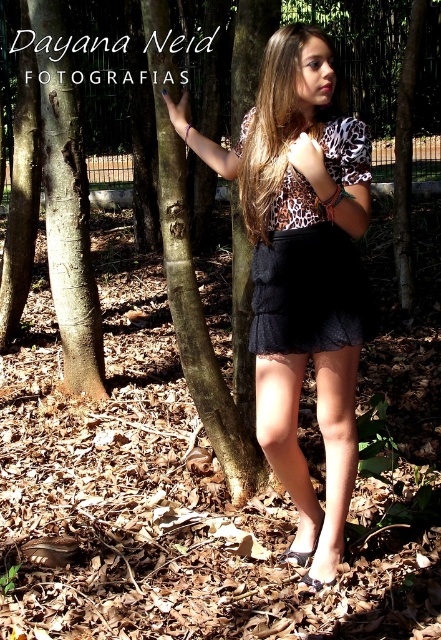
The girl is wearing two skirts, a matte black skirt at center and a black lace skirt at center. Which one is wider?

The matte black skirt at center is wider than the black lace skirt at center.

You are a photographer trying to capture the girl in the scene. You notice the black lace dress at center and the black lace skirt at center. Which one appears larger in the photo due to their positions?

The black lace dress at center appears larger in the photo because it is closer to the viewer than the black lace skirt at center.

You are a photographer trying to capture the girl in the image. You notice both the matte black skirt at center and the black lace dress at center. Which one appears larger in the photo due to their positions?

The matte black skirt at center appears larger in the photo because it is closer to the viewer than the black lace dress at center.